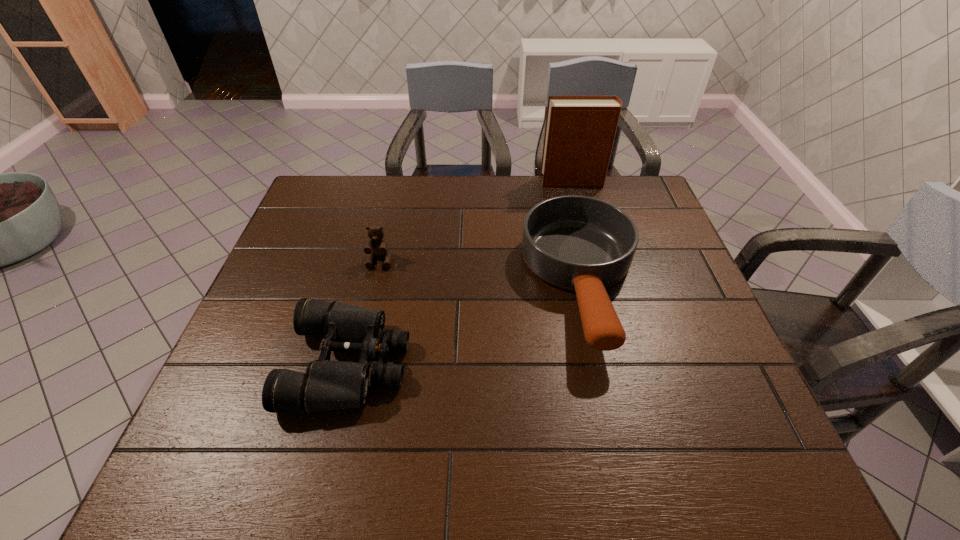
What are the coordinates of `vacant region at the far left corner of the desktop` in the screenshot? It's located at (334, 199).

Locate an element on the screen. free location at the far right corner of the desktop is located at coordinates (652, 200).

Find the location of a particular element. The width and height of the screenshot is (960, 540). free spot at the near right corner of the desktop is located at coordinates (699, 462).

Where is `free space between the farthest object and the binoculars`? free space between the farthest object and the binoculars is located at coordinates (461, 272).

This screenshot has width=960, height=540. What are the coordinates of `vacant area that lies between the tallest object and the shortest object` in the screenshot? It's located at (461, 272).

I want to click on free space between the teddy bear and the pan, so click(481, 272).

Where is `free spot between the pan and the teddy bear`? free spot between the pan and the teddy bear is located at coordinates (481, 272).

In order to click on the closest object to the pan in this screenshot , I will do `click(580, 130)`.

At what (x,y) coordinates should I click in order to perform the action: click on object that is the second closest to the shortest object. Please return your answer as a coordinate pair (x, y). The image size is (960, 540). Looking at the image, I should click on (579, 243).

Identify the location of free space that satisfies the following two spatial constraints: 1. on the open cover of the hardback book; 2. on the handle side of the pan. (600, 284).